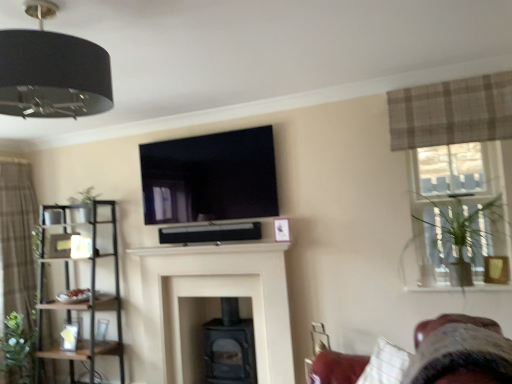
I want to click on empty space that is ontop of black glossy tv at upper center, so click(x=198, y=139).